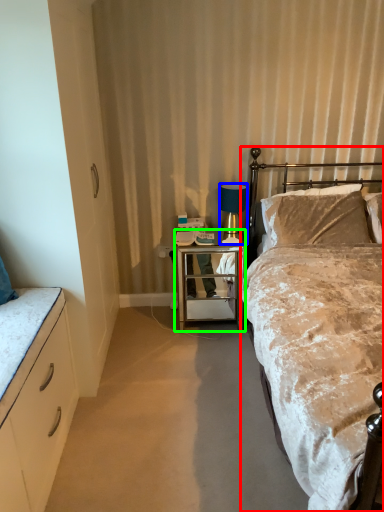
Question: Which object is the farthest from bed (highlighted by a red box)? Choose among these: lamp (highlighted by a blue box) or desk (highlighted by a green box).

Choices:
 (A) lamp
 (B) desk

Answer: (A)